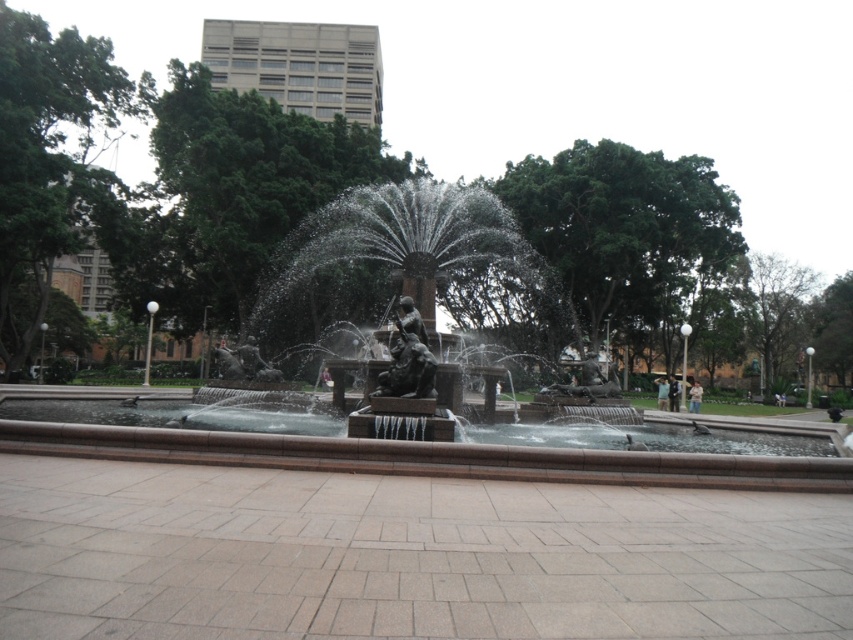
You are standing at the point with coordinates (x=422, y=452) in the park. What object are you standing on?

You are standing on the bronze statue fountain at center, which is represented by the point coordinates (x=422, y=452).

You are planning to place a new decorative planter between the bronze statue fountain at center and the bronze statue at center in the park. Which one should the planter be closer to if you want it to be proportionally balanced with the larger structure?

The bronze statue fountain at center is bigger than the bronze statue at center, so the planter should be placed closer to the bronze statue at center to achieve a balanced look.